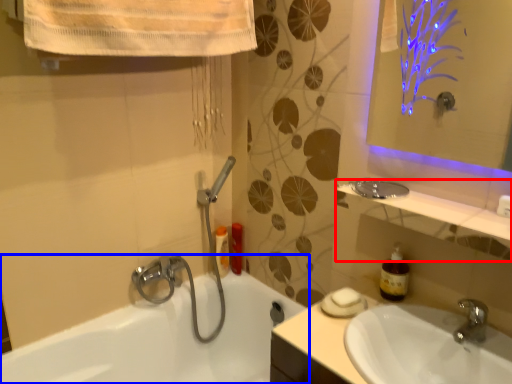
Question: Which object is further to the camera taking this photo, balustrade (highlighted by a red box) or bathtub (highlighted by a blue box)?

Choices:
 (A) balustrade
 (B) bathtub

Answer: (A)